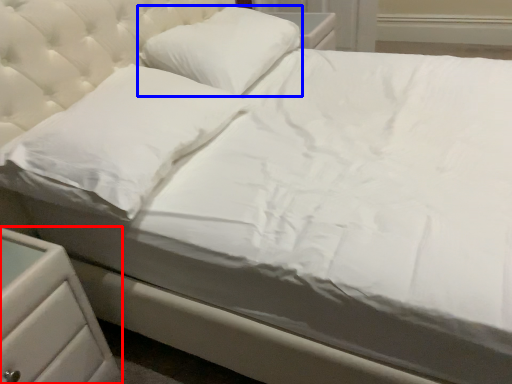
Question: Among these objects, which one is farthest to the camera, nightstand (highlighted by a red box) or pillow (highlighted by a blue box)?

Choices:
 (A) nightstand
 (B) pillow

Answer: (B)